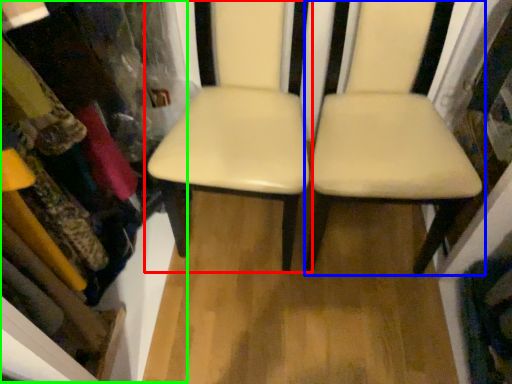
Question: Which object is the farthest from chair (highlighted by a red box)? Choose among these: chair (highlighted by a blue box) or bookshelf (highlighted by a green box).

Choices:
 (A) chair
 (B) bookshelf

Answer: (B)